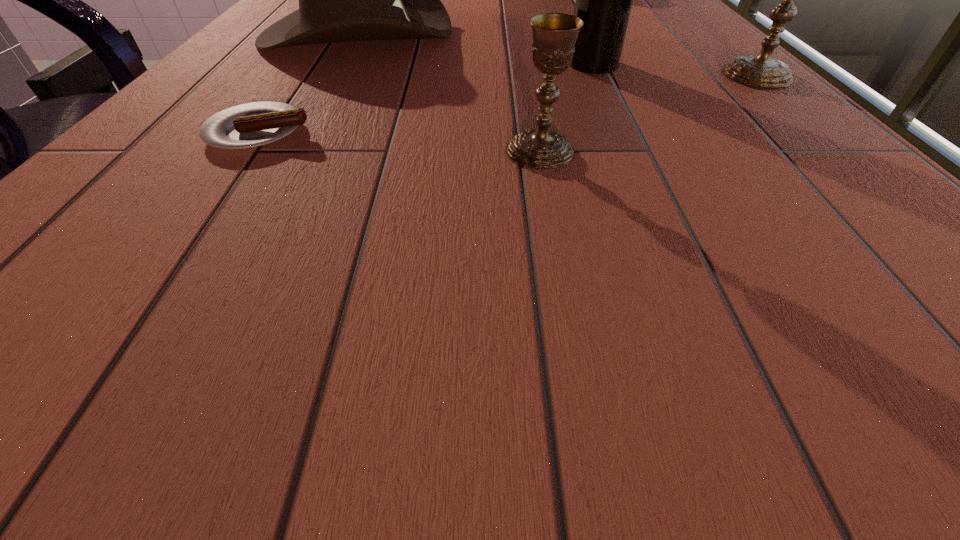
Where is `vacant area at the right edge of the desktop`? vacant area at the right edge of the desktop is located at coordinates (743, 148).

Locate an element on the screen. This screenshot has width=960, height=540. vacant space at the near left corner of the desktop is located at coordinates (40, 231).

You are a GUI agent. You are given a task and a screenshot of the screen. Output one action in this format:
    pyautogui.click(x=<x>, y=<y>)
    Task: Click on the free space at the near right corner of the desktop
    This screenshot has height=540, width=960.
    Given the screenshot: What is the action you would take?
    pyautogui.click(x=830, y=246)

Where is `empty space that is in between the tallest object and the cowboy hat`? empty space that is in between the tallest object and the cowboy hat is located at coordinates (475, 49).

This screenshot has width=960, height=540. I want to click on vacant area that lies between the farther chalice and the shortest object, so click(508, 104).

The width and height of the screenshot is (960, 540). Find the location of `object that can be found as the third closest to the shortest object`. object that can be found as the third closest to the shortest object is located at coordinates (604, 0).

Locate which object ranks fourth in proximity to the shorter chalice. Please provide its 2D coordinates. Your answer should be formatted as a tuple, i.e. [(x, y)], where the tuple contains the x and y coordinates of a point satisfying the conditions above.

[(763, 70)]

You are a GUI agent. You are given a task and a screenshot of the screen. Output one action in this format:
    pyautogui.click(x=<x>, y=<y>)
    Task: Click on the vacant region that satisfies the following two spatial constraints: 1. on the label of the farther chalice; 2. on the left side of the second object from right to left
    This screenshot has width=960, height=540.
    Given the screenshot: What is the action you would take?
    pyautogui.click(x=598, y=76)

Image resolution: width=960 pixels, height=540 pixels. Find the location of `vacant area that satisfies the following two spatial constraints: 1. with a star on the front of the cowboy hat; 2. on the left side of the fourth shortest object`. vacant area that satisfies the following two spatial constraints: 1. with a star on the front of the cowboy hat; 2. on the left side of the fourth shortest object is located at coordinates (332, 76).

The image size is (960, 540). Identify the location of blank area in the image that satisfies the following two spatial constraints: 1. on the label of the tallest object; 2. on the front side of the third object from left to right. coord(634,151).